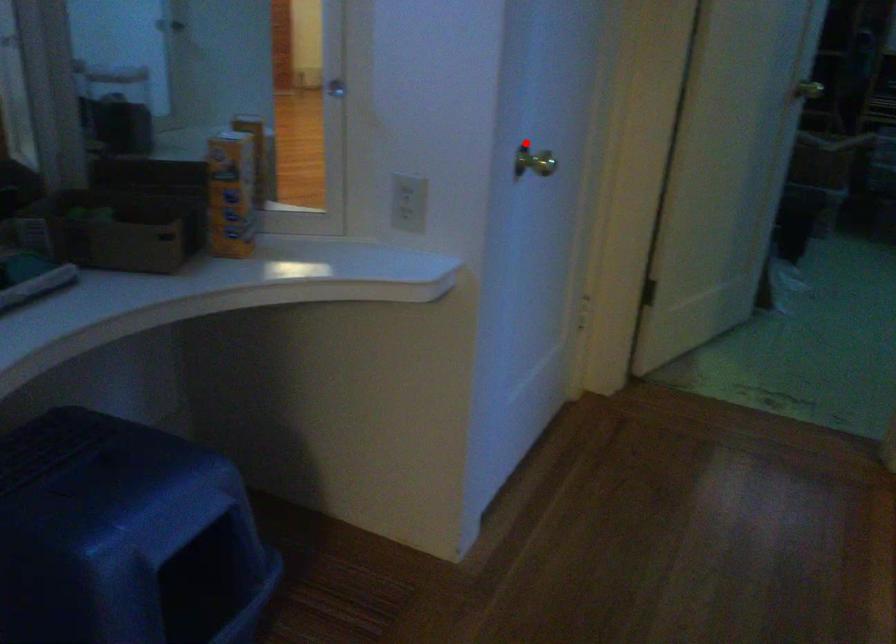
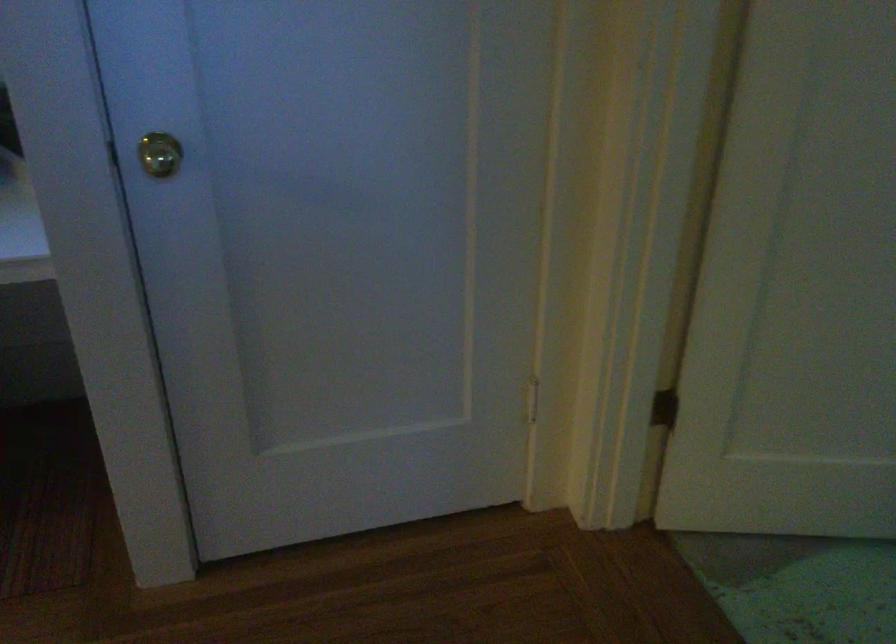
Question: I am providing you with two images of the same scene from different viewpoints. Image1 has a red point marked. In image2, the corresponding 3D location appears at what relative position? Reply with the corresponding letter.

Choices:
 (A) Closer
 (B) Farther

Answer: (A)